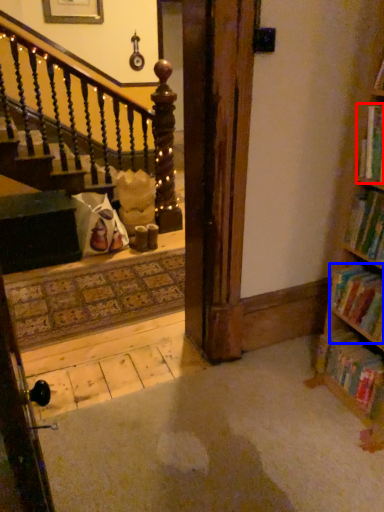
Question: Among these objects, which one is nearest to the camera, book (highlighted by a red box) or book (highlighted by a blue box)?

Choices:
 (A) book
 (B) book

Answer: (A)